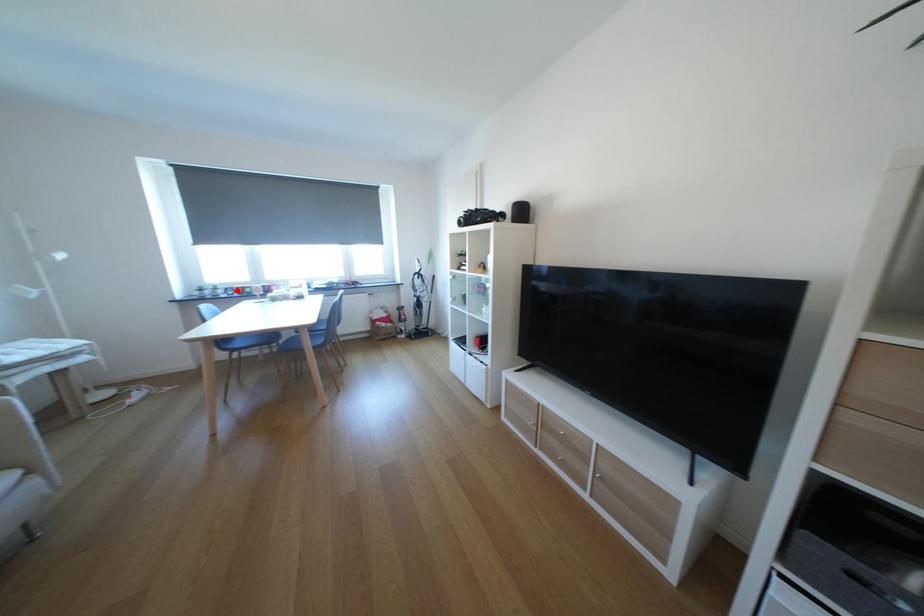
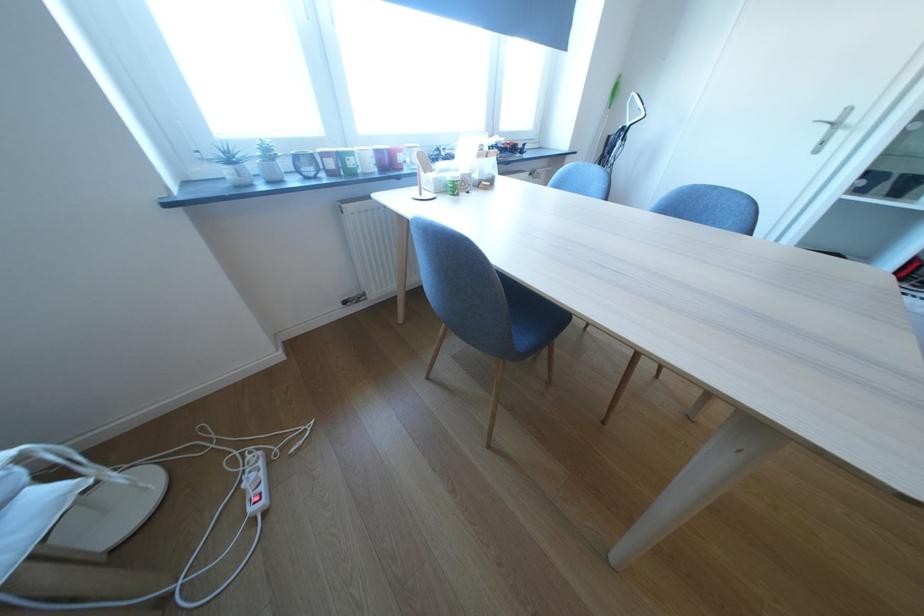
Where in the second image is the point corresponding to the highlighted location from the first image?

(308, 160)